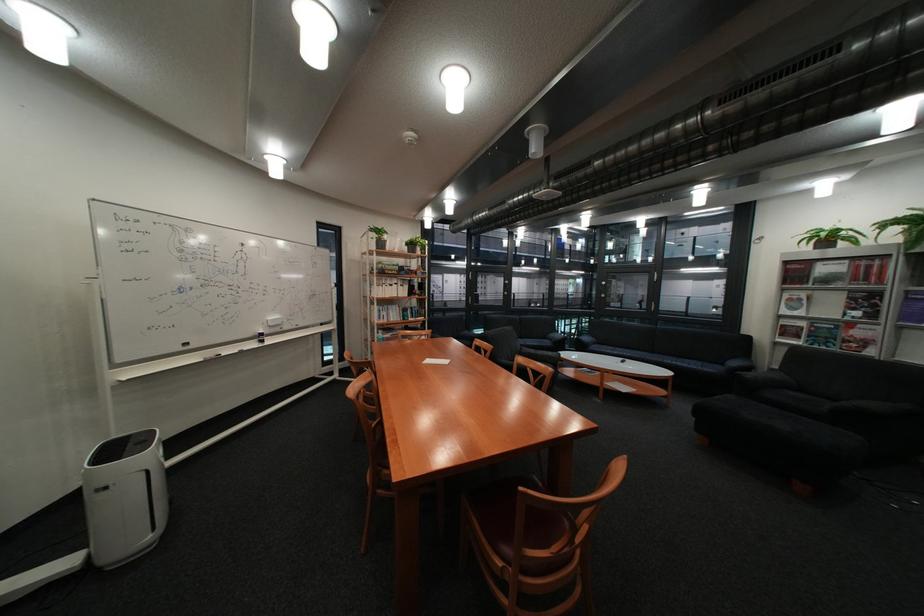
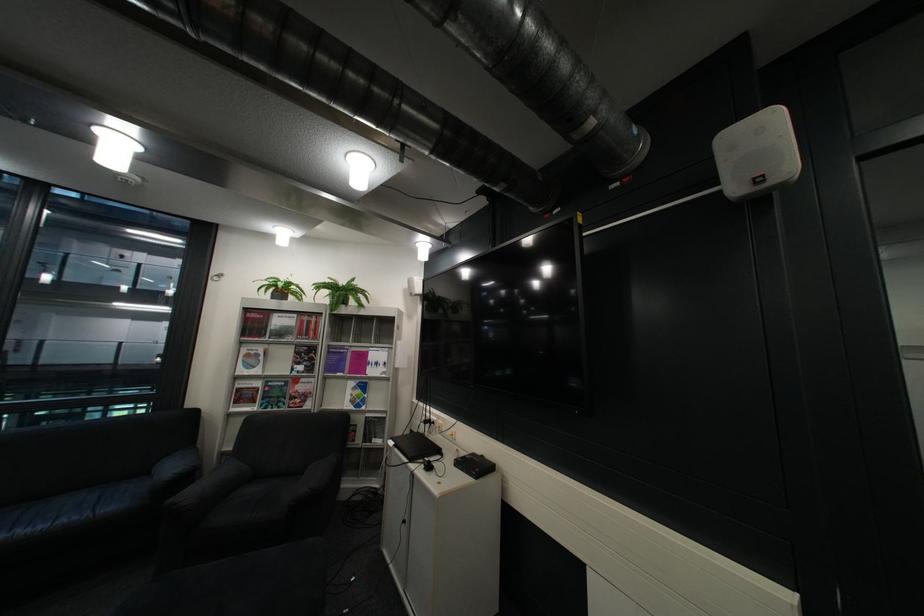
Question: I am providing you with two images of the same scene from different viewpoints. Please identify which objects are invisible in image2.

Choices:
 (A) potted plant
 (B) magazine on shelf
 (C) black laptop
 (D) none of these

Answer: (D)